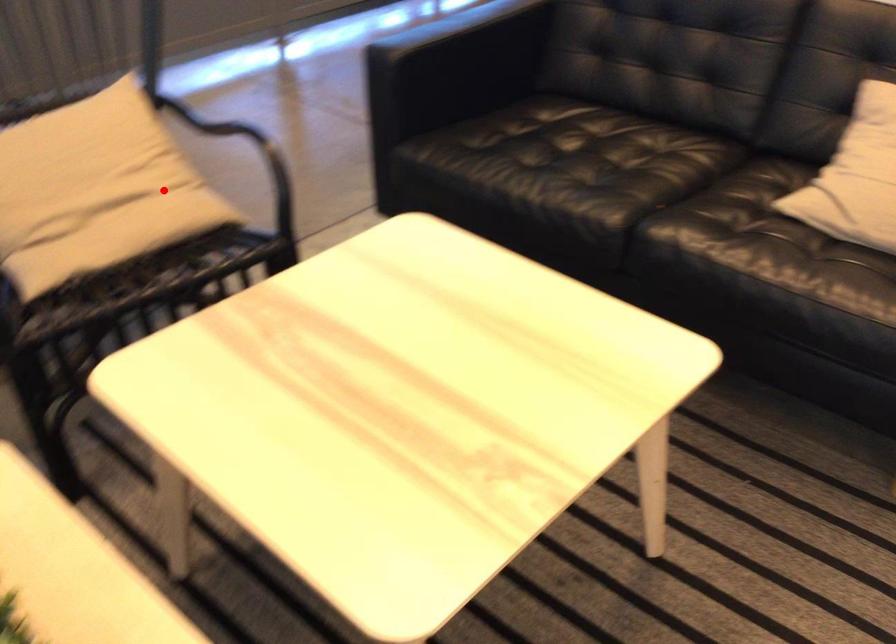
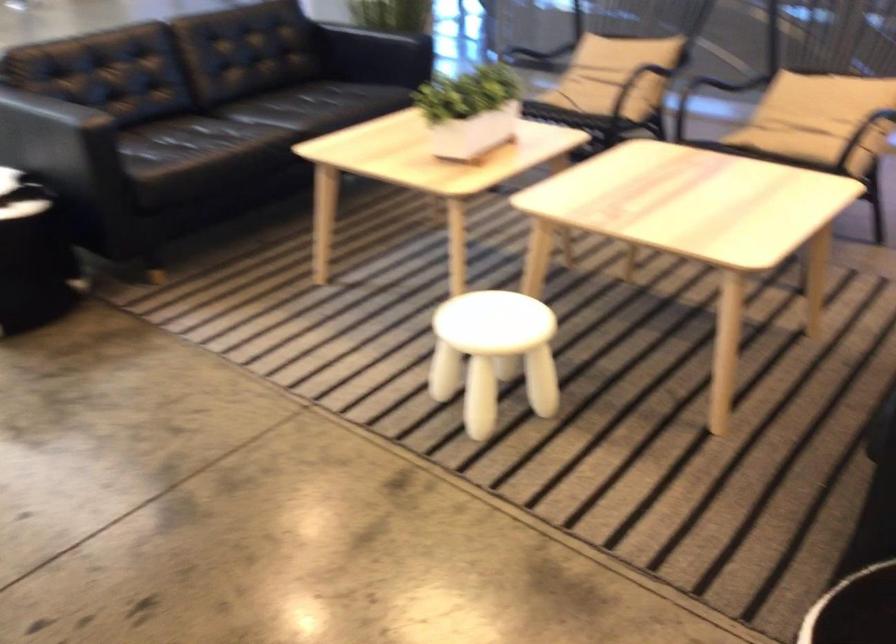
In the second image, find the point that corresponds to the highlighted location in the first image.

(817, 118)